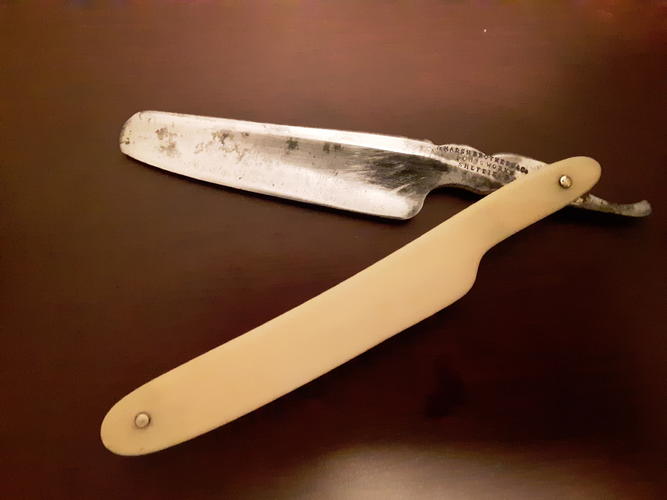
This screenshot has height=500, width=667. In order to click on screws in this screenshot , I will do `click(147, 419)`, `click(565, 179)`.